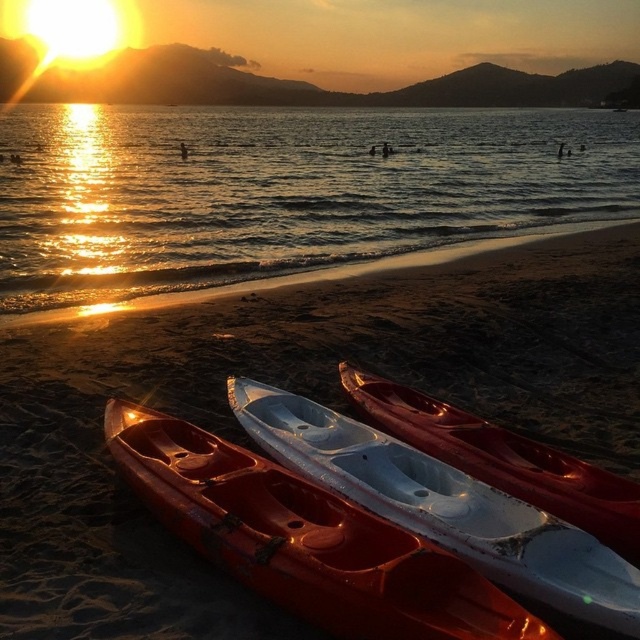
Measure the distance between smooth sand at lower center and shiny golden water at lower left.

A distance of 28.16 meters exists between smooth sand at lower center and shiny golden water at lower left.

Is smooth sand at lower center above shiny golden water at lower left?

Actually, smooth sand at lower center is below shiny golden water at lower left.

The width and height of the screenshot is (640, 640). I want to click on smooth sand at lower center, so click(296, 392).

Who is higher up, shiny golden water at lower left or matte orange canoe at lower left?

shiny golden water at lower left is higher up.

Is point (60, 225) in front of point (445, 573)?

No, it is behind (445, 573).

Where is `shiny golden water at lower left`? shiny golden water at lower left is located at coordinates (282, 189).

Is point (513, 390) positioned behind point (600, 472)?

That is True.

Does point (29, 406) lie in front of point (426, 422)?

No, (29, 406) is further to viewer.

Who is more forward, (35, 552) or (532, 444)?

Point (35, 552) is more forward.

Identify the location of smooth sand at lower center. This screenshot has width=640, height=640. (296, 392).